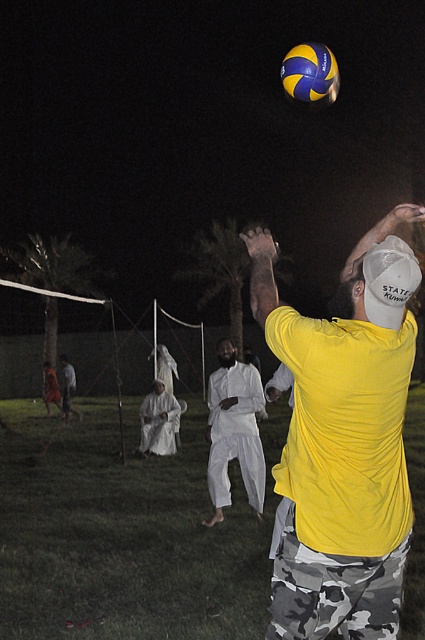
Question: Can you confirm if yellow matte shirt at upper right is bigger than blue and yellow textured volleyball at upper center?

Choices:
 (A) no
 (B) yes

Answer: (A)

Question: Which point is farther to the camera?

Choices:
 (A) white cotton pants at center
 (B) white mesh baseball cap at upper right
 (C) blue and yellow textured volleyball at upper center
 (D) yellow matte shirt at upper right

Answer: (A)

Question: Which of the following is the closest to the observer?

Choices:
 (A) (325, 442)
 (B) (263, 464)
 (C) (368, 321)

Answer: (C)

Question: Which point is closer to the camera taking this photo?

Choices:
 (A) (246, 458)
 (B) (402, 461)
 (C) (416, 276)
 (D) (326, 74)

Answer: (C)

Question: From the image, what is the correct spatial relationship of white cotton pants at center in relation to blue and yellow textured volleyball at upper center?

Choices:
 (A) left
 (B) right

Answer: (A)

Question: Does yellow matte shirt at upper right have a lesser width compared to white cotton pants at center?

Choices:
 (A) yes
 (B) no

Answer: (B)